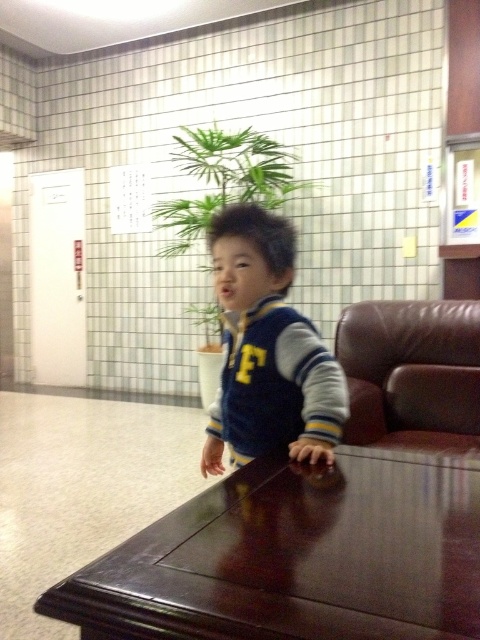
Question: Where is dark brown polished wood table at center located in relation to blue fleece jacket at center in the image?

Choices:
 (A) below
 (B) above

Answer: (A)

Question: Considering the real-world distances, which object is closest to the dark brown polished wood table at center?

Choices:
 (A) blue fleece jacket at center
 (B) brown leather armchair at right

Answer: (A)

Question: Which of the following is the farthest from the observer?

Choices:
 (A) blue fleece jacket at center
 (B) brown leather armchair at right

Answer: (B)

Question: Does dark brown polished wood table at center have a larger size compared to brown leather armchair at right?

Choices:
 (A) yes
 (B) no

Answer: (B)

Question: Can you confirm if dark brown polished wood table at center is wider than blue fleece jacket at center?

Choices:
 (A) no
 (B) yes

Answer: (B)

Question: Which object is the closest to the brown leather armchair at right?

Choices:
 (A) blue fleece jacket at center
 (B) dark brown polished wood table at center

Answer: (A)